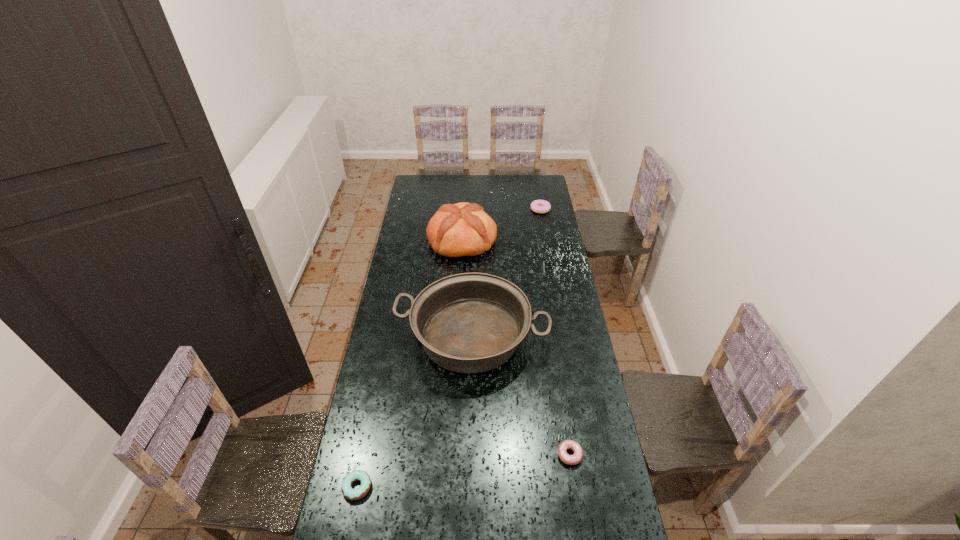
Identify the location of doughnut that is the second closest to the leftmost doughnut. (538, 206).

Where is `doughnut that is the closest to the tallest object`? doughnut that is the closest to the tallest object is located at coordinates (538, 206).

The width and height of the screenshot is (960, 540). I want to click on vacant region that satisfies the following two spatial constraints: 1. on the front side of the fourth nearest object; 2. on the right side of the fourth shortest object, so click(x=457, y=336).

Where is `free location that satisfies the following two spatial constraints: 1. on the back side of the nearest object; 2. on the left side of the third farthest object`? free location that satisfies the following two spatial constraints: 1. on the back side of the nearest object; 2. on the left side of the third farthest object is located at coordinates (388, 336).

Locate an element on the screen. free space that satisfies the following two spatial constraints: 1. on the back side of the second tallest object; 2. on the left side of the tallest doughnut is located at coordinates (474, 210).

I want to click on blank area in the image that satisfies the following two spatial constraints: 1. on the back side of the leftmost doughnut; 2. on the left side of the pan, so click(x=388, y=336).

You are a GUI agent. You are given a task and a screenshot of the screen. Output one action in this format:
    pyautogui.click(x=<x>, y=<y>)
    Task: Click on the free space that satisfies the following two spatial constraints: 1. on the back side of the third farthest object; 2. on the right side of the third shortest object
    
    Given the screenshot: What is the action you would take?
    474,210